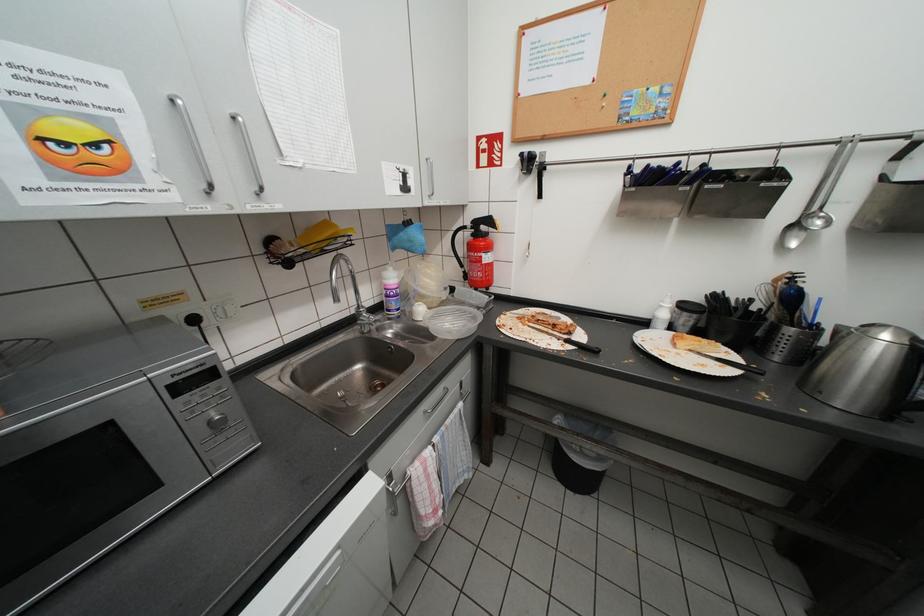
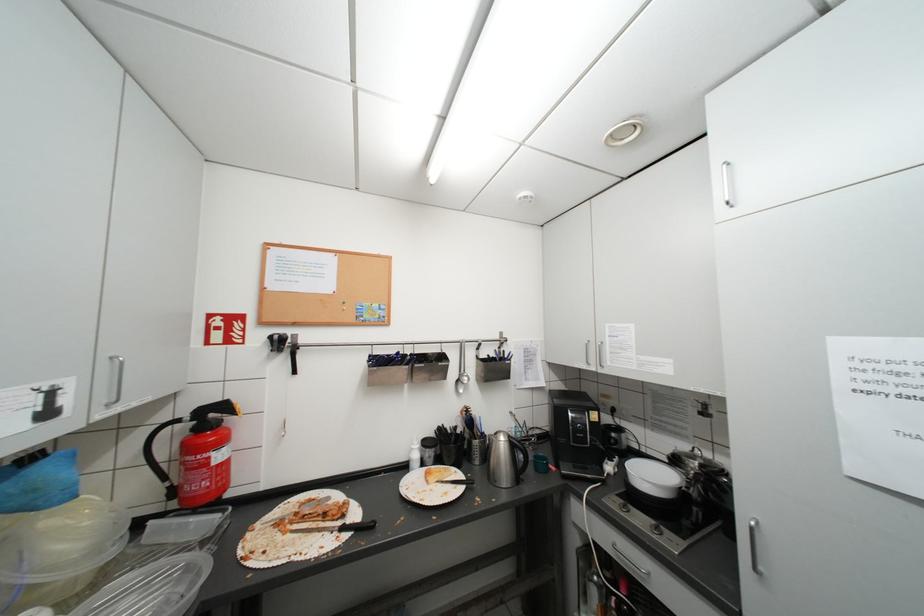
The first image is from the beginning of the video and the second image is from the end. How did the camera likely rotate when shooting the video?

The camera rotated toward right-up.